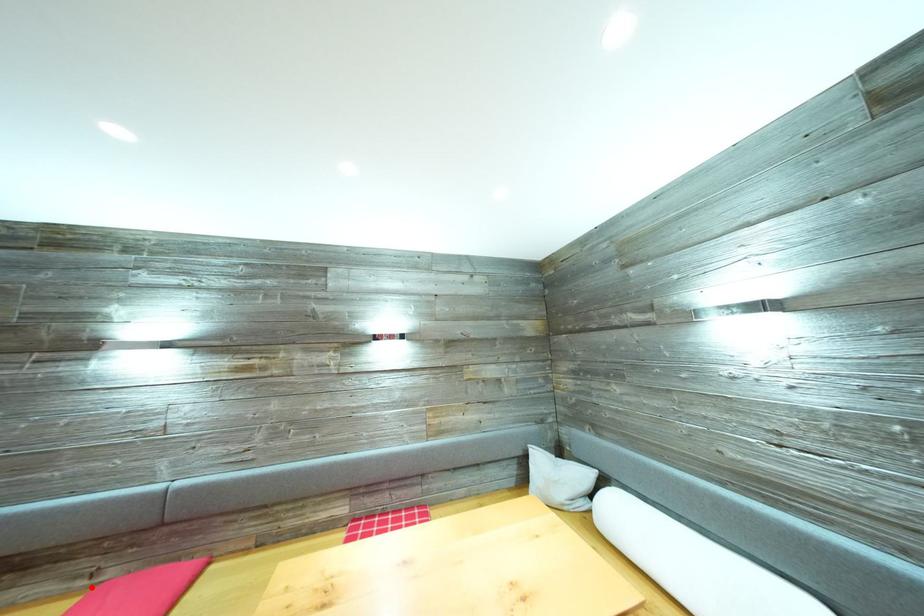
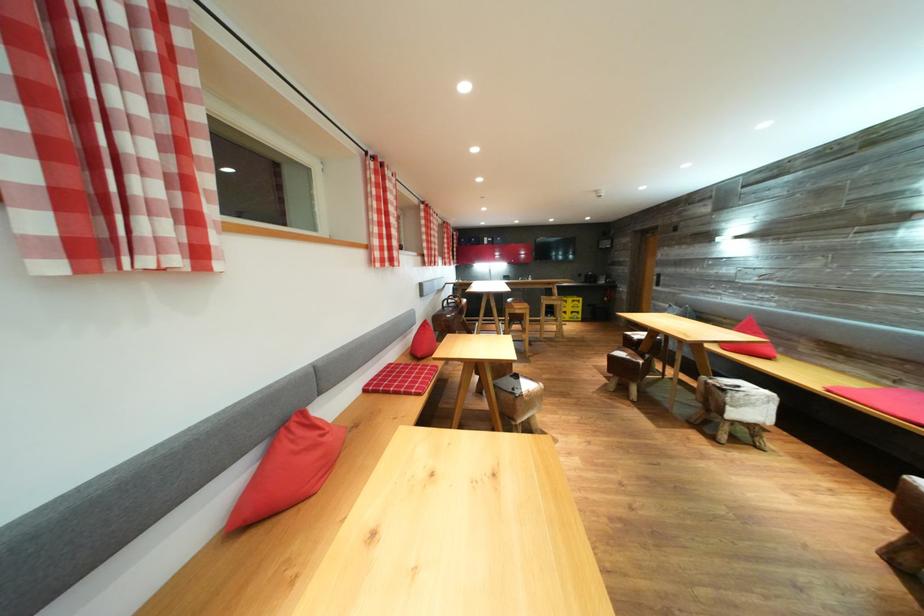
Question: A red point is marked in image1. In image2, is the corresponding 3D point closer to the camera or farther? Reply with the corresponding letter.

Choices:
 (A) The corresponding 3D point is closer.
 (B) The corresponding 3D point is farther.

Answer: (B)